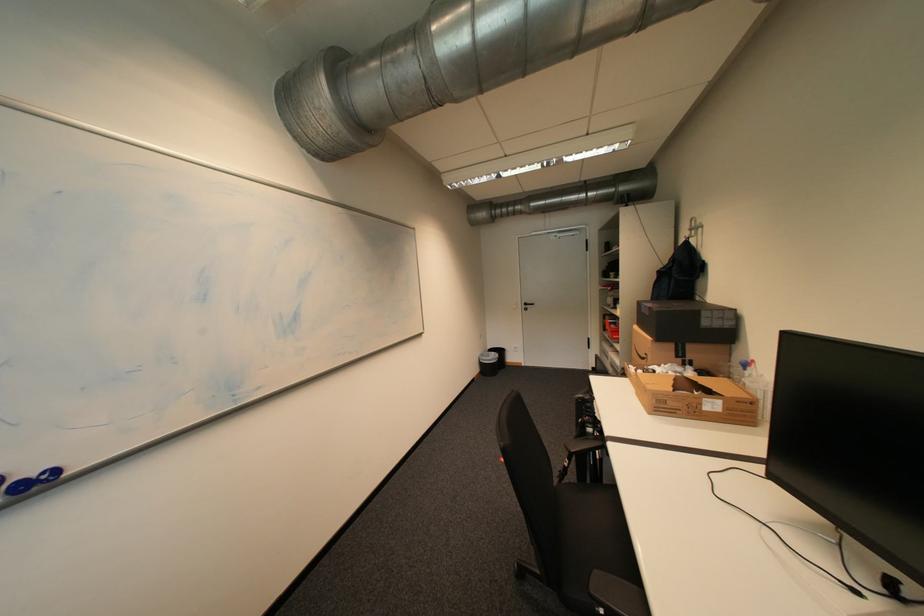
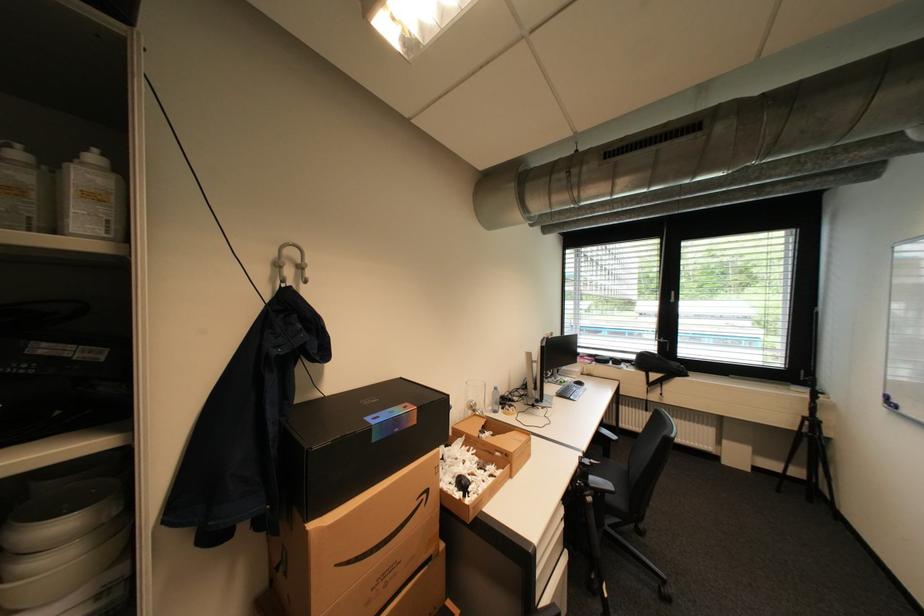
Where in the second image is the point corresponding to (720,391) from the first image?

(492, 426)